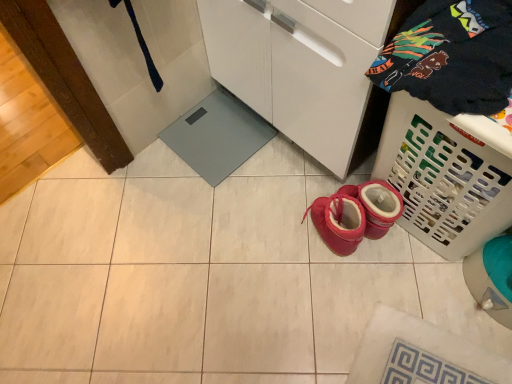
Where is `dark blue cotton t-shirt at upper right`? dark blue cotton t-shirt at upper right is located at coordinates (452, 56).

Measure the distance between dark blue cotton t-shirt at upper right and camera.

dark blue cotton t-shirt at upper right and camera are 30.10 inches apart from each other.

Describe the element at coordinates (452, 56) in the screenshot. I see `dark blue cotton t-shirt at upper right` at that location.

The height and width of the screenshot is (384, 512). Describe the element at coordinates (446, 175) in the screenshot. I see `white plastic laundry basket at lower right` at that location.

The width and height of the screenshot is (512, 384). Identify the location of white plastic laundry basket at lower right. (446, 175).

In the scene shown: What is the approximate width of white plastic laundry basket at lower right?

10.61 inches.

Where is `dark blue cotton t-shirt at upper right`? The width and height of the screenshot is (512, 384). dark blue cotton t-shirt at upper right is located at coordinates (452, 56).

Does dark blue cotton t-shirt at upper right appear on the left side of white plastic laundry basket at lower right?

Correct, you'll find dark blue cotton t-shirt at upper right to the left of white plastic laundry basket at lower right.

Is the depth of dark blue cotton t-shirt at upper right less than that of white plastic laundry basket at lower right?

Yes, dark blue cotton t-shirt at upper right is closer to the viewer.

Is point (447, 29) closer to camera compared to point (416, 100)?

Yes, point (447, 29) is closer to viewer.

From the image's perspective, would you say dark blue cotton t-shirt at upper right is shown under white plastic laundry basket at lower right?

No.

From a real-world perspective, is dark blue cotton t-shirt at upper right positioned above or below white plastic laundry basket at lower right?

In terms of real-world spatial position, dark blue cotton t-shirt at upper right is above white plastic laundry basket at lower right.

Can you confirm if dark blue cotton t-shirt at upper right is thinner than white plastic laundry basket at lower right?

In fact, dark blue cotton t-shirt at upper right might be wider than white plastic laundry basket at lower right.

Can you confirm if dark blue cotton t-shirt at upper right is taller than white plastic laundry basket at lower right?

Incorrect, the height of dark blue cotton t-shirt at upper right is not larger of that of white plastic laundry basket at lower right.

Considering the relative sizes of dark blue cotton t-shirt at upper right and white plastic laundry basket at lower right in the image provided, is dark blue cotton t-shirt at upper right smaller than white plastic laundry basket at lower right?

Yes, dark blue cotton t-shirt at upper right is smaller than white plastic laundry basket at lower right.

Can white plastic laundry basket at lower right be found inside dark blue cotton t-shirt at upper right?

No, white plastic laundry basket at lower right is not a part of dark blue cotton t-shirt at upper right.

In the scene shown: Would you say dark blue cotton t-shirt at upper right is a long distance from white plastic laundry basket at lower right?

No, dark blue cotton t-shirt at upper right is in close proximity to white plastic laundry basket at lower right.

Is dark blue cotton t-shirt at upper right turned away from white plastic laundry basket at lower right?

No, white plastic laundry basket at lower right is not at the back of dark blue cotton t-shirt at upper right.

How different are the orientations of dark blue cotton t-shirt at upper right and white plastic laundry basket at lower right in degrees?

The angle between the facing direction of dark blue cotton t-shirt at upper right and the facing direction of white plastic laundry basket at lower right is 5.14e-05 degrees.

Consider the image. How far apart are dark blue cotton t-shirt at upper right and white plastic laundry basket at lower right?

The distance of dark blue cotton t-shirt at upper right from white plastic laundry basket at lower right is 21.33 centimeters.

Identify the location of basket to the right of dark blue cotton t-shirt at upper right. This screenshot has width=512, height=384. (446, 175).

Which is more to the right, white plastic laundry basket at lower right or dark blue cotton t-shirt at upper right?

Positioned to the right is white plastic laundry basket at lower right.

Which is behind, white plastic laundry basket at lower right or dark blue cotton t-shirt at upper right?

Positioned behind is white plastic laundry basket at lower right.

Is point (381, 152) closer to camera compared to point (502, 9)?

No, (381, 152) is behind (502, 9).

From the image's perspective, which is above, white plastic laundry basket at lower right or dark blue cotton t-shirt at upper right?

dark blue cotton t-shirt at upper right.

From a real-world perspective, is white plastic laundry basket at lower right positioned above or below dark blue cotton t-shirt at upper right?

In terms of real-world spatial position, white plastic laundry basket at lower right is below dark blue cotton t-shirt at upper right.

In terms of width, does white plastic laundry basket at lower right look wider or thinner when compared to dark blue cotton t-shirt at upper right?

Considering their sizes, white plastic laundry basket at lower right looks slimmer than dark blue cotton t-shirt at upper right.

Based on the photo, does white plastic laundry basket at lower right have a lesser height compared to dark blue cotton t-shirt at upper right?

In fact, white plastic laundry basket at lower right may be taller than dark blue cotton t-shirt at upper right.

Can you confirm if white plastic laundry basket at lower right is bigger than dark blue cotton t-shirt at upper right?

Indeed, white plastic laundry basket at lower right has a larger size compared to dark blue cotton t-shirt at upper right.

Is white plastic laundry basket at lower right not within dark blue cotton t-shirt at upper right?

white plastic laundry basket at lower right lies outside dark blue cotton t-shirt at upper right's area.

Are white plastic laundry basket at lower right and dark blue cotton t-shirt at upper right located far from each other?

No, white plastic laundry basket at lower right is not far from dark blue cotton t-shirt at upper right.

Is white plastic laundry basket at lower right oriented towards dark blue cotton t-shirt at upper right?

No, white plastic laundry basket at lower right is not turned towards dark blue cotton t-shirt at upper right.

How different are the orientations of white plastic laundry basket at lower right and dark blue cotton t-shirt at upper right in degrees?

The facing directions of white plastic laundry basket at lower right and dark blue cotton t-shirt at upper right are 5.14e-05 degrees apart.

Locate an element on the screen. The height and width of the screenshot is (384, 512). clothing above the white plastic laundry basket at lower right (from a real-world perspective) is located at coordinates (452, 56).

You are a GUI agent. You are given a task and a screenshot of the screen. Output one action in this format:
    pyautogui.click(x=<x>, y=<y>)
    Task: Click on the basket that appears behind the dark blue cotton t-shirt at upper right
    This screenshot has width=512, height=384.
    Given the screenshot: What is the action you would take?
    pyautogui.click(x=446, y=175)

Locate an element on the screen. Image resolution: width=512 pixels, height=384 pixels. basket that appears below the dark blue cotton t-shirt at upper right (from the image's perspective) is located at coordinates (446, 175).